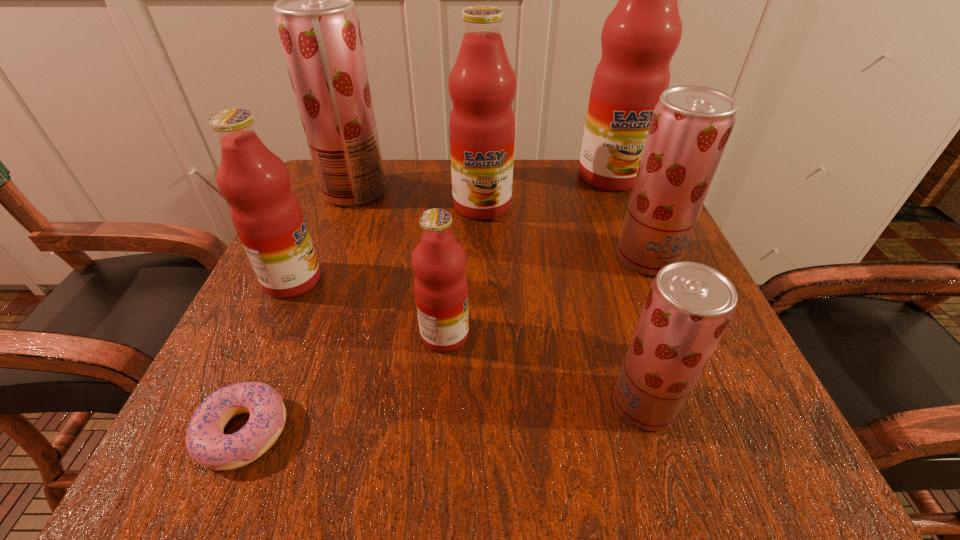
Where is `the smallest strawberry fruit juice`? the smallest strawberry fruit juice is located at coordinates (689, 305).

The image size is (960, 540). In order to click on the nearest strawberry fruit juice in this screenshot , I will do `click(689, 305)`.

I want to click on the shortest object, so click(206, 443).

I want to click on pink doughnut, so click(x=206, y=443).

Find the location of a particular element. free space located 0.110m on the label of the biggest pink fruit juice is located at coordinates (629, 223).

In order to click on blank area located on the right of the leftmost strawberry fruit juice in this screenshot , I will do (x=466, y=191).

Where is `free region located 0.190m on the label of the second biggest pink fruit juice`? free region located 0.190m on the label of the second biggest pink fruit juice is located at coordinates (483, 287).

This screenshot has width=960, height=540. What are the coordinates of `free space located 0.050m on the back of the second biggest strawberry fruit juice` in the screenshot? It's located at (633, 224).

Identify the location of free spot located on the label of the second smallest pink fruit juice. The height and width of the screenshot is (540, 960). (440, 280).

Where is `free space located on the label of the smallest pink fruit juice`? free space located on the label of the smallest pink fruit juice is located at coordinates (610, 335).